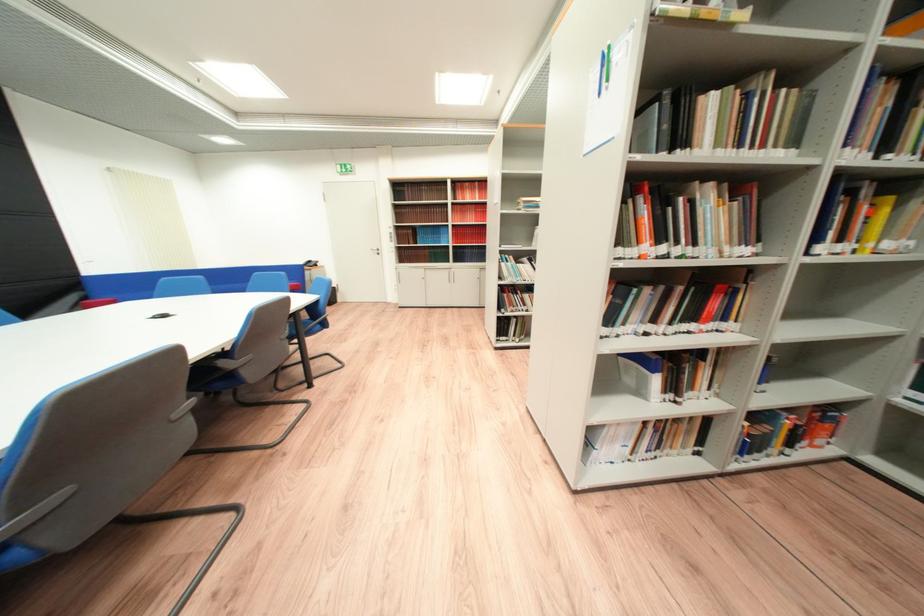
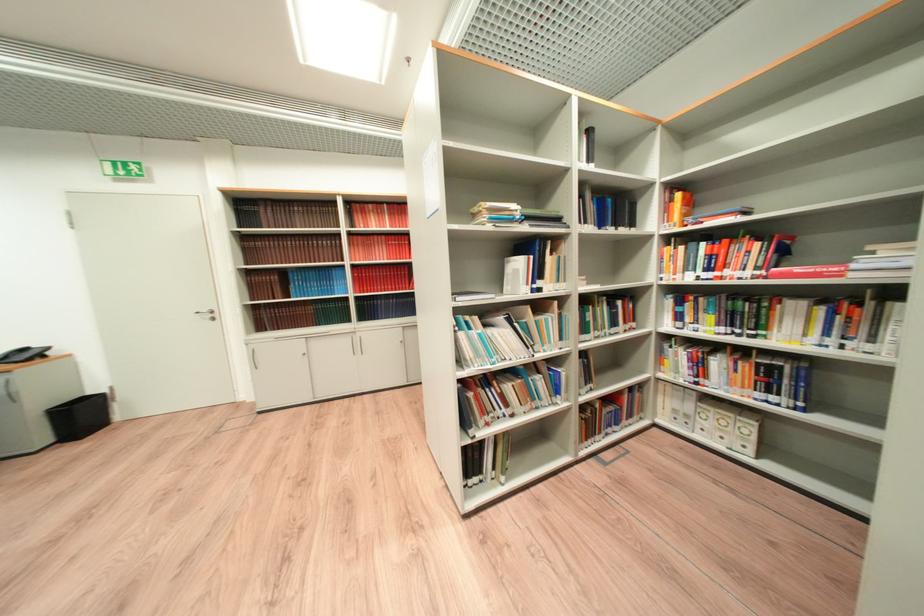
Question: The images are taken continuously from a first-person perspective. In which direction are you moving?

Choices:
 (A) Left
 (B) Right
 (C) Forward
 (D) Backward

Answer: (C)